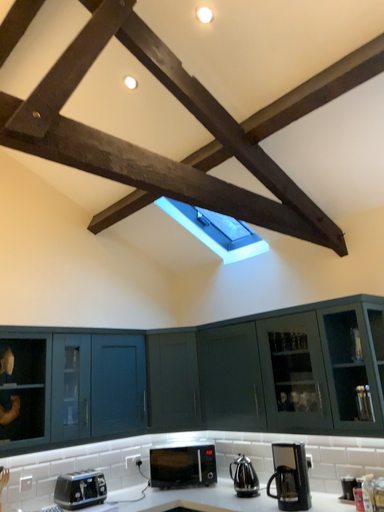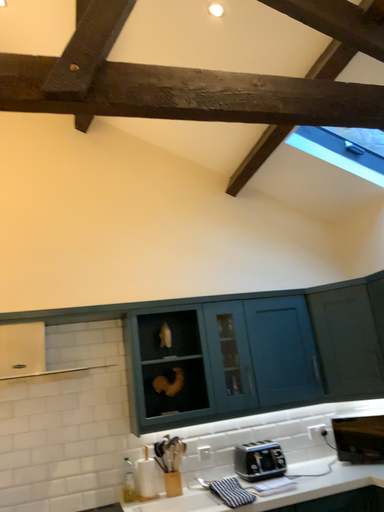
Question: How did the camera likely rotate when shooting the video?

Choices:
 (A) rotated left
 (B) rotated right

Answer: (A)